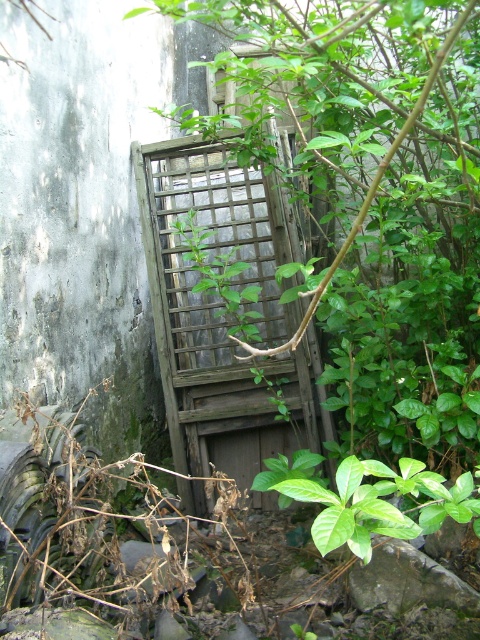
In the scene shown: Is weathered wood trellis at center to the left of green leafy plant at center from the viewer's perspective?

Indeed, weathered wood trellis at center is positioned on the left side of green leafy plant at center.

Can you confirm if weathered wood trellis at center is taller than green leafy plant at center?

Yes.

In order to click on weathered wood trellis at center in this screenshot , I will do `click(222, 317)`.